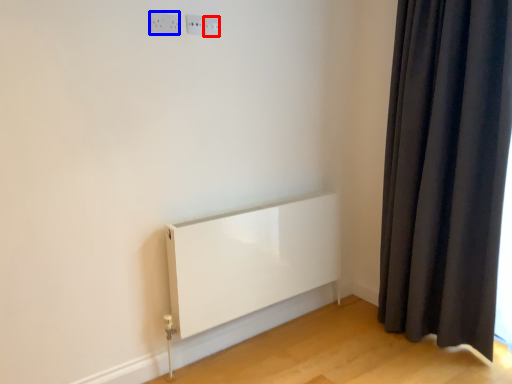
Question: Which point is further to the camera, electric outlet (highlighted by a red box) or electric outlet (highlighted by a blue box)?

Choices:
 (A) electric outlet
 (B) electric outlet

Answer: (A)